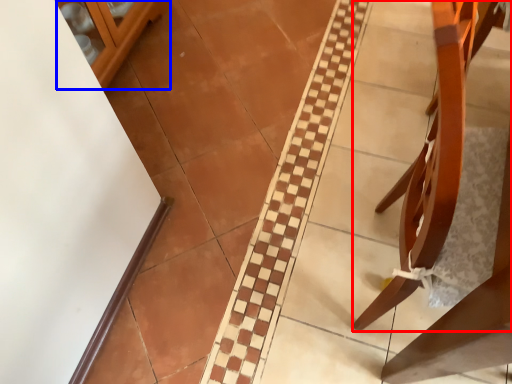
Question: Which of the following is the farthest to the observer, furniture (highlighted by a red box) or glass door (highlighted by a blue box)?

Choices:
 (A) furniture
 (B) glass door

Answer: (B)